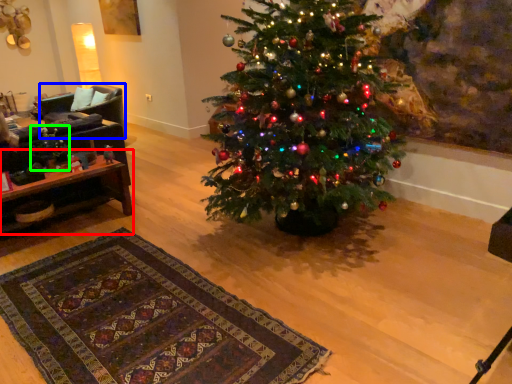
Question: Considering the real-world distances, which object is closest to table (highlighted by a red box)? armchair (highlighted by a blue box) or christmas decoration (highlighted by a green box).

Choices:
 (A) armchair
 (B) christmas decoration

Answer: (B)